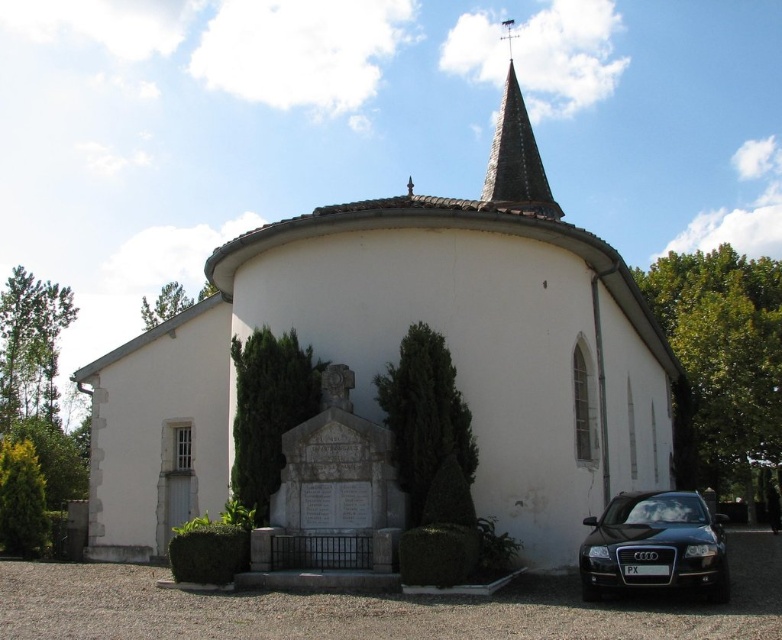
You are standing at the point marked by coordinates point (x=393, y=356) in the image. What is the nearest object to you?

The nearest object to you at point (x=393, y=356) is the white smooth church at center, as the coordinates directly indicate its location.

You are planning to place a new bench between the white smooth church at center and the green textured hedge at center. Based on their widths, which side of the bench should be closer to the wider object to ensure stability?

The white smooth church at center might be wider than the green textured hedge at center, so the bench should be placed closer to the white smooth church at center to ensure stability.